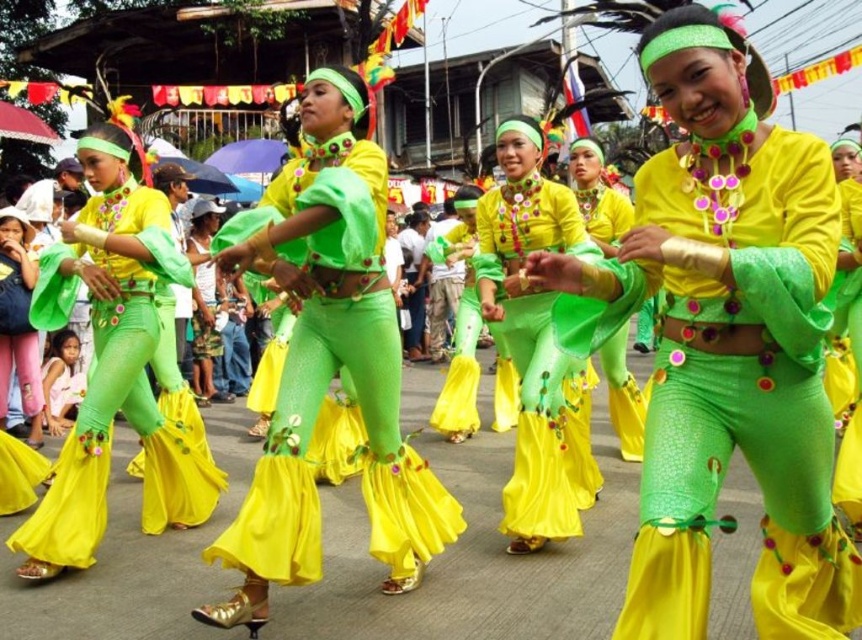
From the picture: You are a photographer standing at the front of the street performance. You want to take a closeup shot of the shiny green fabric skirt at left. Considering the distance, is it feasible to capture a clear closeup without moving closer?

The shiny green fabric skirt at left is 17.70 feet away from the viewer. A standard camera lens can capture clear closeup shots from this distance, so it is feasible to take a clear closeup without moving closer.

Looking at this image, you are a photographer trying to capture the dancers in the scene. You notice the green textured fabric at center and the shiny green fabric skirt at left. Which object should you focus on if you want to photograph the taller one?

The shiny green fabric skirt at left is taller than the green textured fabric at center, so focus on the shiny green fabric skirt at left to capture the taller object.